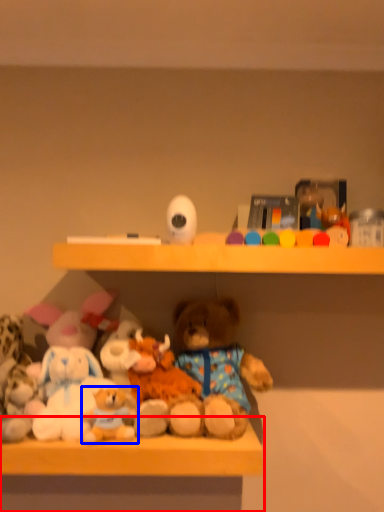
Question: Among these objects, which one is nearest to the camera, table (highlighted by a red box) or toy (highlighted by a blue box)?

Choices:
 (A) table
 (B) toy

Answer: (A)